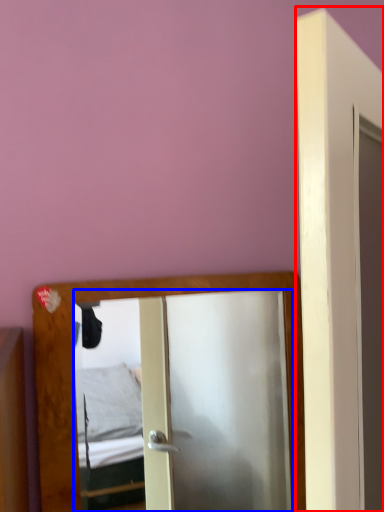
Question: Which object is closer to the camera taking this photo, door (highlighted by a red box) or mirror (highlighted by a blue box)?

Choices:
 (A) door
 (B) mirror

Answer: (A)